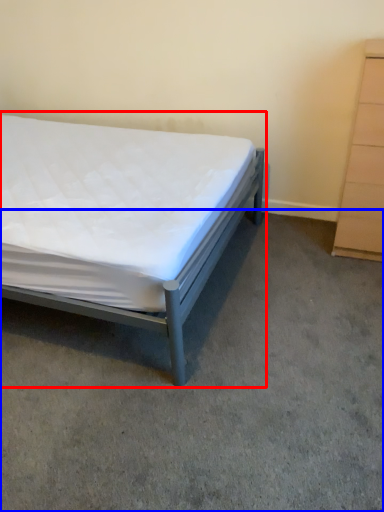
Question: Which of the following is the closest to the observer, bed (highlighted by a red box) or concrete (highlighted by a blue box)?

Choices:
 (A) bed
 (B) concrete

Answer: (B)